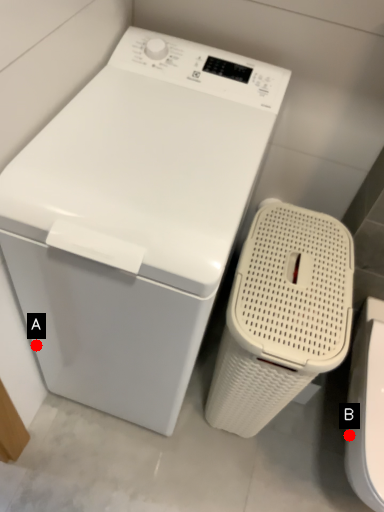
Question: Two points are circled on the image, labeled by A and B beside each circle. Which point is closer to the camera?

Choices:
 (A) A is closer
 (B) B is closer

Answer: (B)